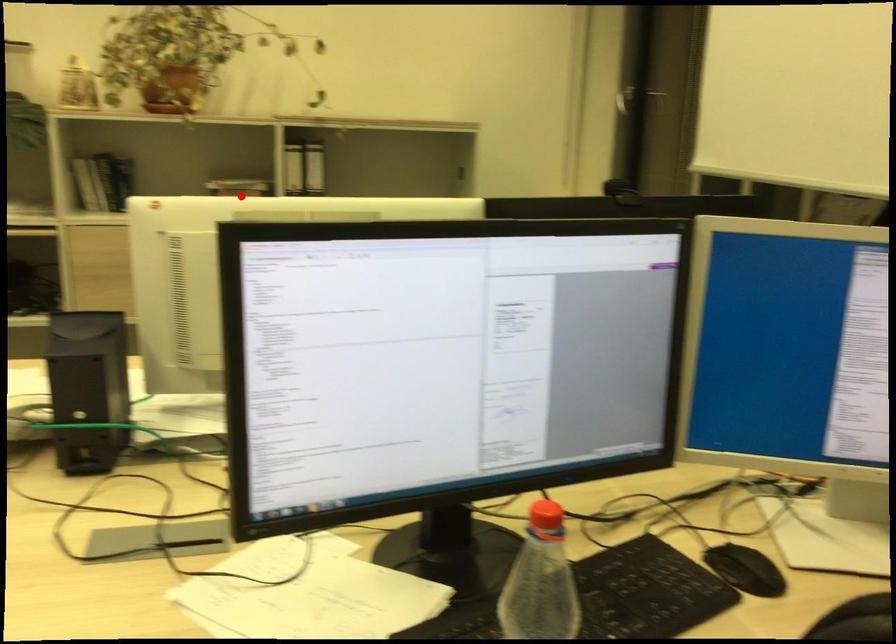
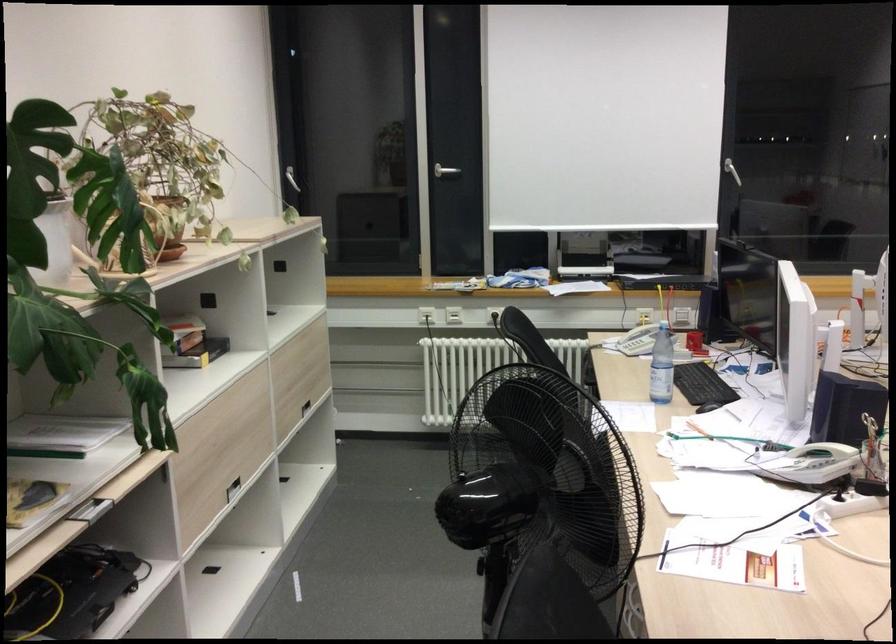
Question: I am providing you with two images of the same scene from different viewpoints. A red point is shown in image1. For the corresponding object point in image2, is it positioned nearer or farther from the camera?

Choices:
 (A) Nearer
 (B) Farther

Answer: (A)